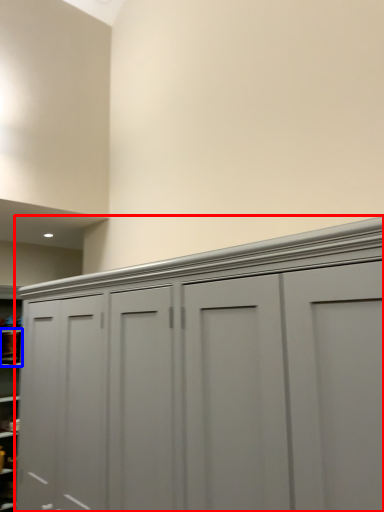
Question: Which object is closer to the camera taking this photo, cupboard (highlighted by a red box) or cabinet (highlighted by a blue box)?

Choices:
 (A) cupboard
 (B) cabinet

Answer: (A)